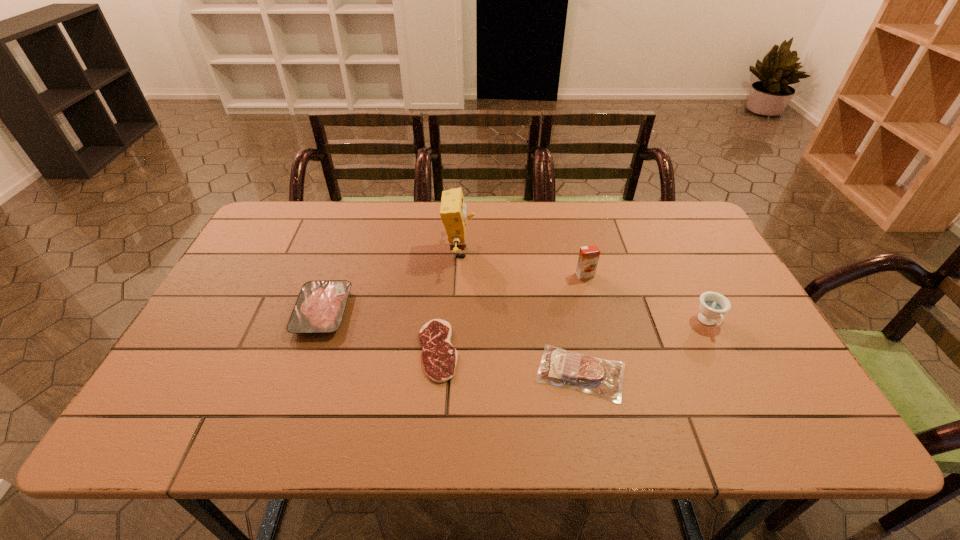
Identify the location of vacant space located on the side of the rightmost object with the handle. (735, 377).

Where is `vacant space located on the back of the leftmost steak`? The width and height of the screenshot is (960, 540). vacant space located on the back of the leftmost steak is located at coordinates (336, 275).

Identify the location of free location located 0.350m on the left of the rightmost steak. (384, 373).

I want to click on free space located 0.050m on the front of the second steak from left to right, so click(x=433, y=403).

Image resolution: width=960 pixels, height=540 pixels. I want to click on object situated at the far edge, so click(x=453, y=210).

Image resolution: width=960 pixels, height=540 pixels. Find the location of `object at the right edge`. object at the right edge is located at coordinates (713, 305).

In the image, there is a desktop. Identify the location of vacant area at the far edge. The width and height of the screenshot is (960, 540). (395, 226).

Locate an element on the screen. The image size is (960, 540). vacant area at the near edge of the desktop is located at coordinates (545, 424).

You are a GUI agent. You are given a task and a screenshot of the screen. Output one action in this format:
    pyautogui.click(x=<x>, y=<y>)
    Task: Click on the free space at the left edge of the desktop
    The height and width of the screenshot is (540, 960).
    Given the screenshot: What is the action you would take?
    pyautogui.click(x=186, y=380)

In the image, there is a desktop. Where is `vacant space at the right edge`? This screenshot has height=540, width=960. vacant space at the right edge is located at coordinates click(777, 384).